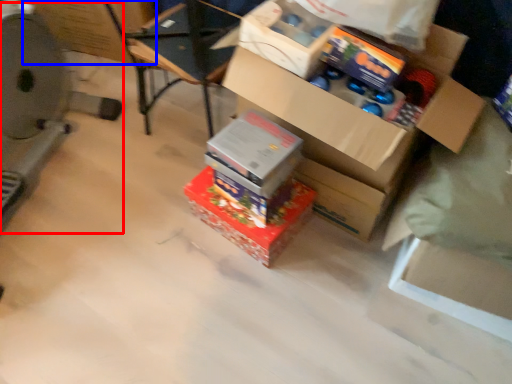
Question: Which of the following is the closest to the observer, wide (highlighted by a red box) or cardboard box (highlighted by a blue box)?

Choices:
 (A) wide
 (B) cardboard box

Answer: (A)